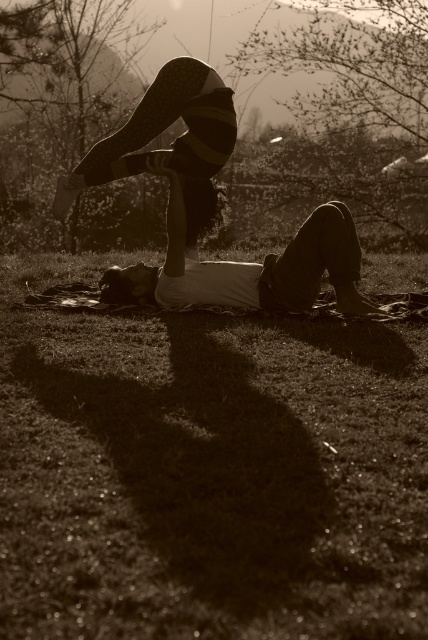
Between matte black pants at center and striped leggings at upper center, which one is positioned lower?

matte black pants at center is lower down.

Is matte black pants at center closer to camera compared to striped leggings at upper center?

That is False.

You are a GUI agent. You are given a task and a screenshot of the screen. Output one action in this format:
    pyautogui.click(x=<x>, y=<y>)
    Task: Click on the matte black pants at center
    The width and height of the screenshot is (428, 640).
    Given the screenshot: What is the action you would take?
    pyautogui.click(x=240, y=262)

What do you see at coordinates (208, 472) in the screenshot? The height and width of the screenshot is (640, 428). I see `green grass at lower center` at bounding box center [208, 472].

Can you confirm if green grass at lower center is positioned below striped leggings at upper center?

Yes, green grass at lower center is below striped leggings at upper center.

Where is `green grass at lower center`? The width and height of the screenshot is (428, 640). green grass at lower center is located at coordinates (208, 472).

This screenshot has height=640, width=428. Find the location of `green grass at lower center`. green grass at lower center is located at coordinates (208, 472).

Which is more to the right, green grass at lower center or matte black pants at center?

matte black pants at center

This screenshot has width=428, height=640. I want to click on green grass at lower center, so click(x=208, y=472).